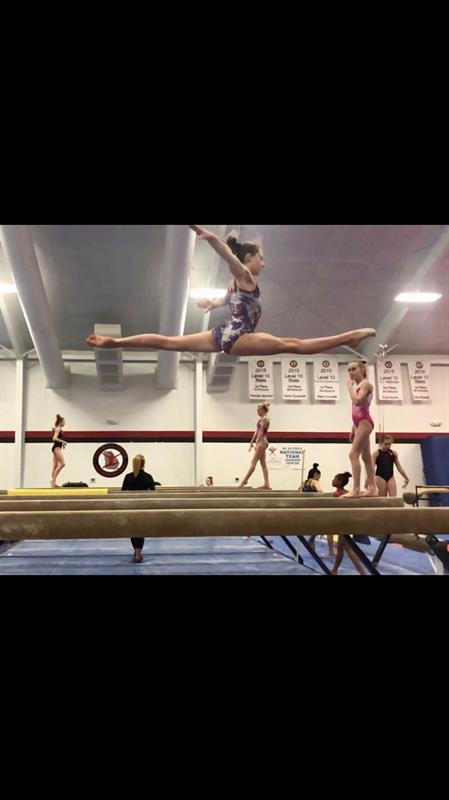
Find the location of `beams in gym`. beams in gym is located at coordinates (183, 522), (191, 504), (184, 493), (161, 490), (212, 488).